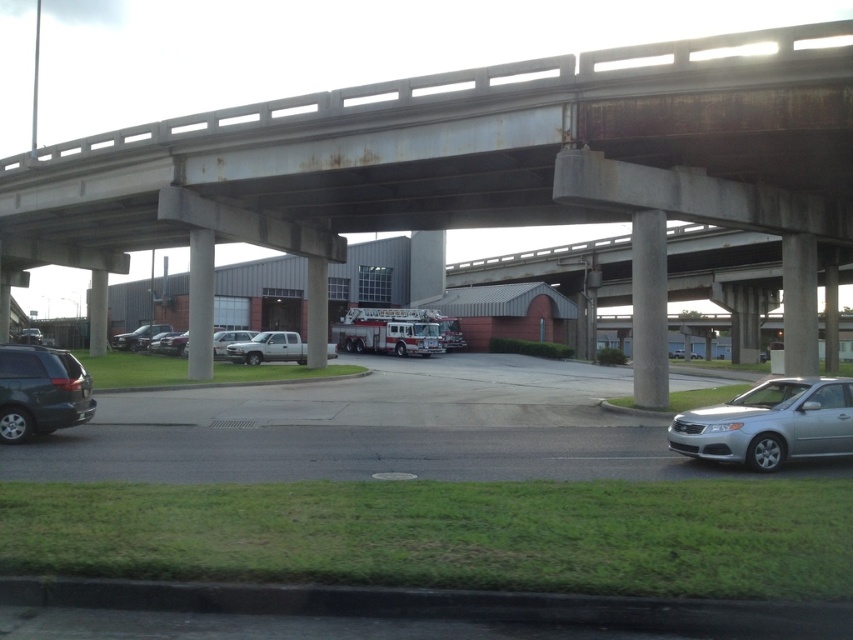
Question: Is the position of rusty concrete bridge at upper center more distant than that of white metallic fire truck at center?

Choices:
 (A) yes
 (B) no

Answer: (B)

Question: Based on their relative distances, which object is nearer to the silver metallic truck at center?

Choices:
 (A) silver metallic sedan at lower right
 (B) satin silver car at lower right
 (C) rusty concrete bridge at upper center
 (D) matte black minivan at lower left

Answer: (C)

Question: Does satin silver car at lower right appear on the right side of silver metallic sedan at lower right?

Choices:
 (A) no
 (B) yes

Answer: (A)

Question: Among these objects, which one is nearest to the camera?

Choices:
 (A) rusty concrete bridge at upper center
 (B) white metallic fire truck at center
 (C) silver metallic truck at center

Answer: (A)

Question: Is matte black minivan at lower left behind silver metallic truck at center?

Choices:
 (A) no
 (B) yes

Answer: (A)

Question: Which point appears closest to the camera in this image?

Choices:
 (A) (444, 349)
 (B) (22, 417)

Answer: (B)